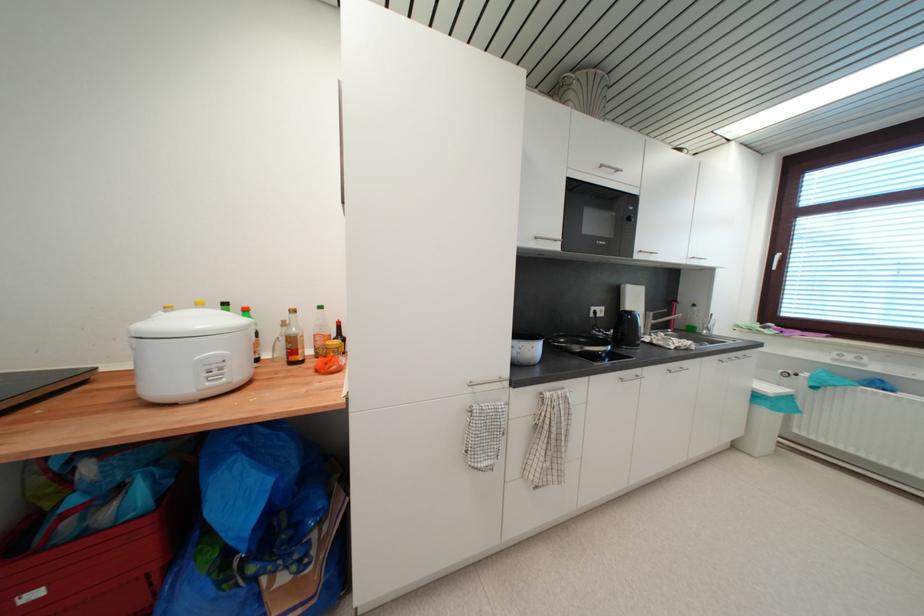
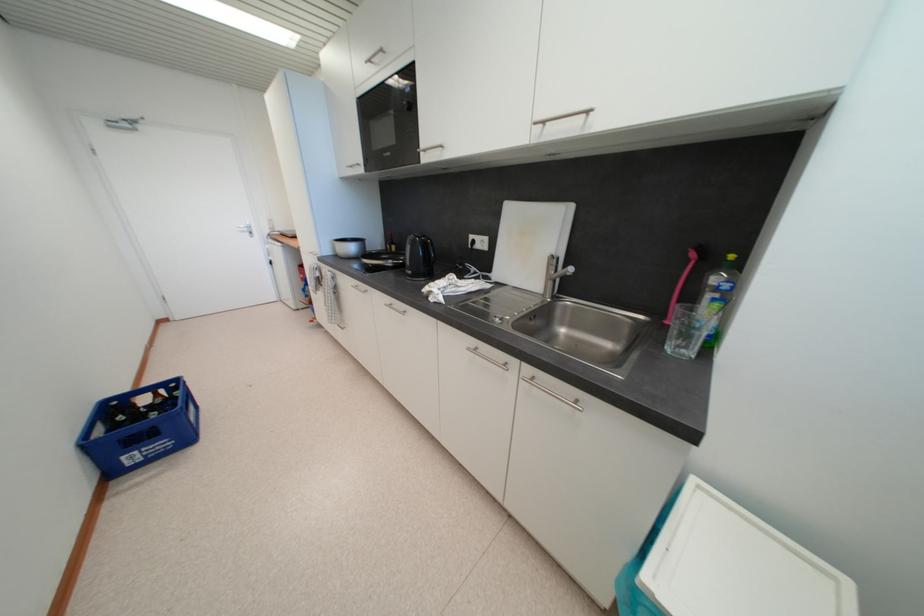
Where in the second image is the point corresponding to (606,168) from the first image?

(375, 63)